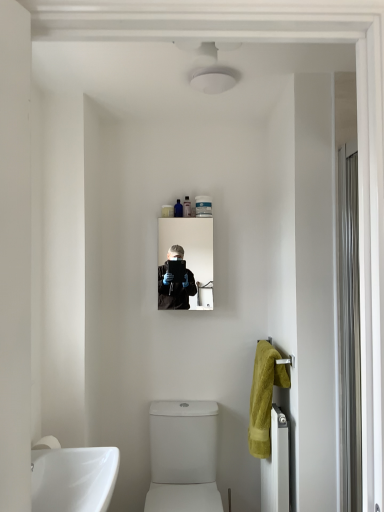
Question: Is soft yellow towel at right facing towards white matte tube at upper center, arranged as the 1th toiletry when viewed from the right?

Choices:
 (A) no
 (B) yes

Answer: (A)

Question: Does soft yellow towel at right have a lesser width compared to white matte tube at upper center, arranged as the 1th toiletry when viewed from the right?

Choices:
 (A) yes
 (B) no

Answer: (B)

Question: Is soft yellow towel at right far from white matte tube at upper center, placed as the third toiletry when sorted from left to right?

Choices:
 (A) no
 (B) yes

Answer: (A)

Question: Is soft yellow towel at right smaller than white matte tube at upper center, arranged as the 1th toiletry when viewed from the right?

Choices:
 (A) yes
 (B) no

Answer: (B)

Question: From the image's perspective, is soft yellow towel at right below white matte tube at upper center, placed as the third toiletry when sorted from left to right?

Choices:
 (A) no
 (B) yes

Answer: (B)

Question: From a real-world perspective, relative to white metallic radiator at lower right, is translucent plastic container at upper center, which ranks as the 1th toiletry in left-to-right order, vertically above or below?

Choices:
 (A) above
 (B) below

Answer: (A)

Question: Relative to white metallic radiator at lower right, is translucent plastic container at upper center, which ranks as the 1th toiletry in left-to-right order, in front or behind?

Choices:
 (A) behind
 (B) front

Answer: (A)

Question: Is point (170, 207) positioned closer to the camera than point (284, 435)?

Choices:
 (A) farther
 (B) closer

Answer: (A)

Question: From the image's perspective, is translucent plastic container at upper center, which appears as the 3th toiletry when viewed from the right, positioned above or below white metallic radiator at lower right?

Choices:
 (A) below
 (B) above

Answer: (B)

Question: In terms of width, does clear glass mirror at center look wider or thinner when compared to translucent plastic container at upper center, which appears as the 3th toiletry when viewed from the right?

Choices:
 (A) wide
 (B) thin

Answer: (A)

Question: Based on their positions, is clear glass mirror at center located to the left or right of translucent plastic container at upper center, which appears as the 3th toiletry when viewed from the right?

Choices:
 (A) right
 (B) left

Answer: (A)

Question: Considering the positions of point (160, 251) and point (168, 216), is point (160, 251) closer or farther from the camera than point (168, 216)?

Choices:
 (A) farther
 (B) closer

Answer: (B)

Question: Based on their sizes in the image, would you say clear glass mirror at center is bigger or smaller than translucent plastic container at upper center, which ranks as the 1th toiletry in left-to-right order?

Choices:
 (A) big
 (B) small

Answer: (A)

Question: In the image, is translucent plastic tube at upper center, which is counted as the second toiletry, starting from the right, positioned in front of or behind clear glass screen door at right?

Choices:
 (A) behind
 (B) front

Answer: (A)

Question: Considering the positions of translucent plastic tube at upper center, which is counted as the second toiletry, starting from the right, and clear glass screen door at right in the image, is translucent plastic tube at upper center, which is counted as the second toiletry, starting from the right, taller or shorter than clear glass screen door at right?

Choices:
 (A) short
 (B) tall

Answer: (A)